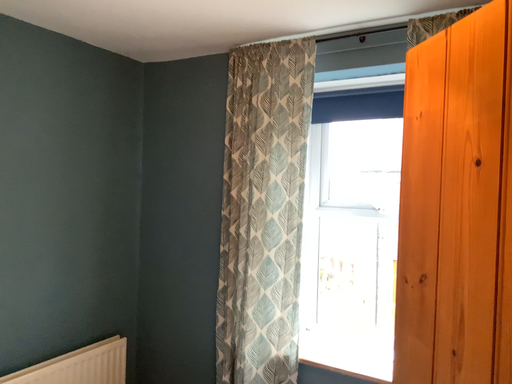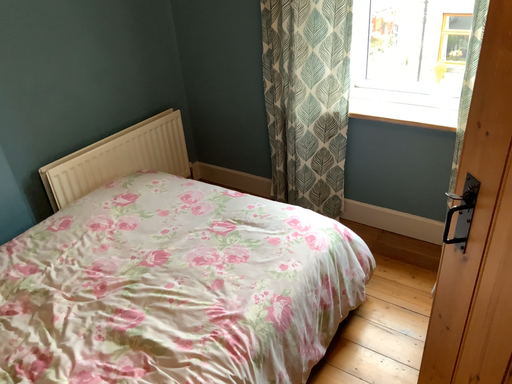
Question: How did the camera likely rotate when shooting the video?

Choices:
 (A) rotated upward
 (B) rotated downward

Answer: (B)